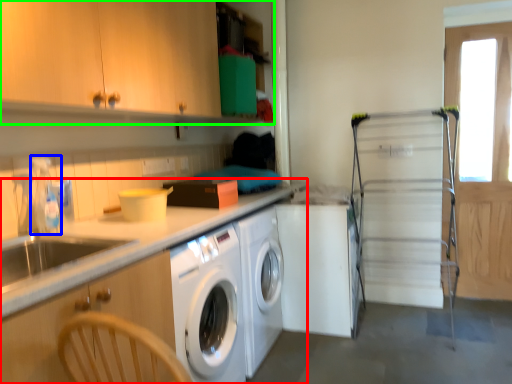
Question: Considering the real-world distances, which object is closest to countertop (highlighted by a red box)? faucet (highlighted by a blue box) or cabinetry (highlighted by a green box).

Choices:
 (A) faucet
 (B) cabinetry

Answer: (A)